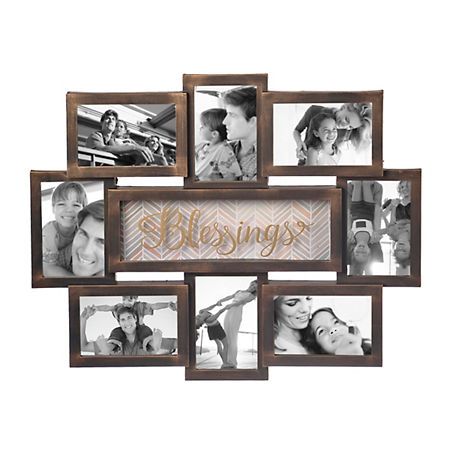
Locate an element on the screen. This screenshot has height=450, width=450. horizontal frames is located at coordinates (133, 327), (322, 323), (253, 241), (327, 152), (142, 143).